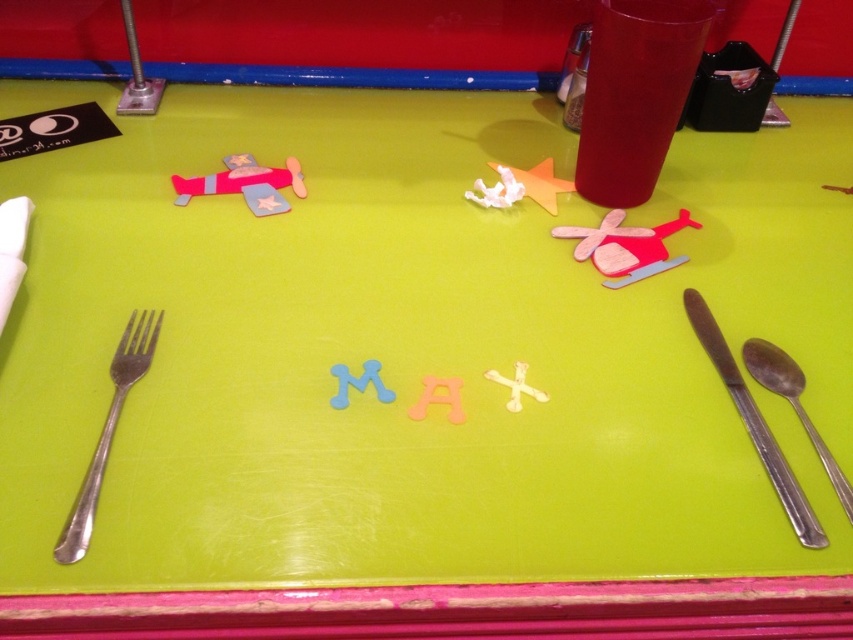
Can you confirm if silver metallic knife and spoon at lower right is thinner than white matte letter x at center?

Yes.

What do you see at coordinates (753, 422) in the screenshot? The image size is (853, 640). I see `silver metallic knife and spoon at lower right` at bounding box center [753, 422].

Between point (724, 369) and point (538, 390), which one is positioned in front?

Positioned in front is point (538, 390).

Image resolution: width=853 pixels, height=640 pixels. I want to click on silver metallic knife and spoon at lower right, so click(x=753, y=422).

Is white matte starfish at upper center shorter than white matte letter x at center?

In fact, white matte starfish at upper center may be taller than white matte letter x at center.

Who is more forward, (x=534, y=193) or (x=500, y=376)?

Positioned in front is point (x=500, y=376).

Is point (532, 172) closer to camera compared to point (508, 403)?

No, (532, 172) is behind (508, 403).

Identify the location of white matte starfish at upper center. This screenshot has width=853, height=640. (543, 184).

Is wooden red helicopter at center-right wider than blue foam letter m at center?

Yes, wooden red helicopter at center-right is wider than blue foam letter m at center.

Is wooden red helicopter at center-right taller than blue foam letter m at center?

Correct, wooden red helicopter at center-right is much taller as blue foam letter m at center.

At what (x,y) coordinates should I click in order to perform the action: click on wooden red helicopter at center-right. Please return your answer as a coordinate pair (x, y). Looking at the image, I should click on 625,246.

Image resolution: width=853 pixels, height=640 pixels. I want to click on wooden red helicopter at center-right, so click(625, 246).